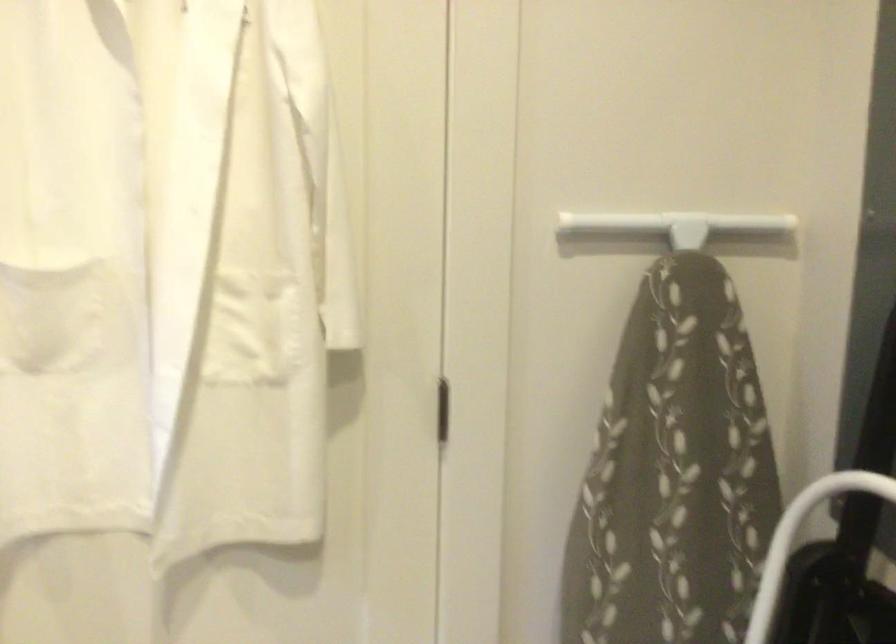
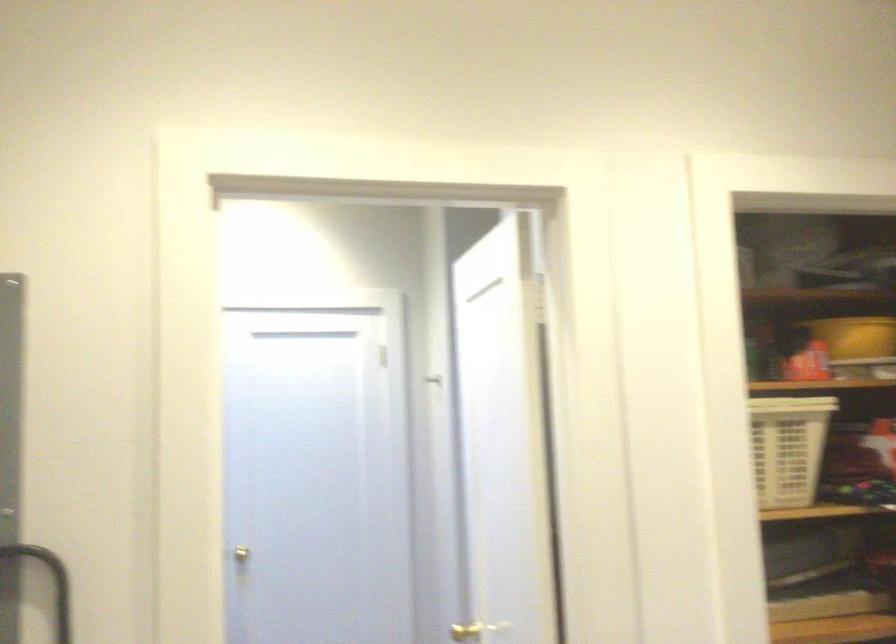
Question: The camera is either moving clockwise (left) or counter-clockwise (right) around the object. The first image is from the beginning of the video and the second image is from the end. Is the camera moving left or right when shooting the video?

Choices:
 (A) Left
 (B) Right

Answer: (A)